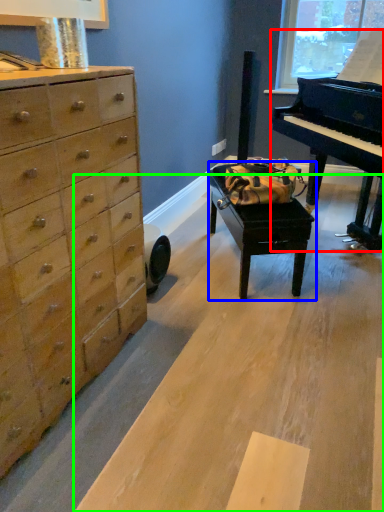
Question: Which object is positioned farthest from piano (highlighted by a red box)? Select from table (highlighted by a blue box) and plywood (highlighted by a green box).

Choices:
 (A) table
 (B) plywood

Answer: (B)